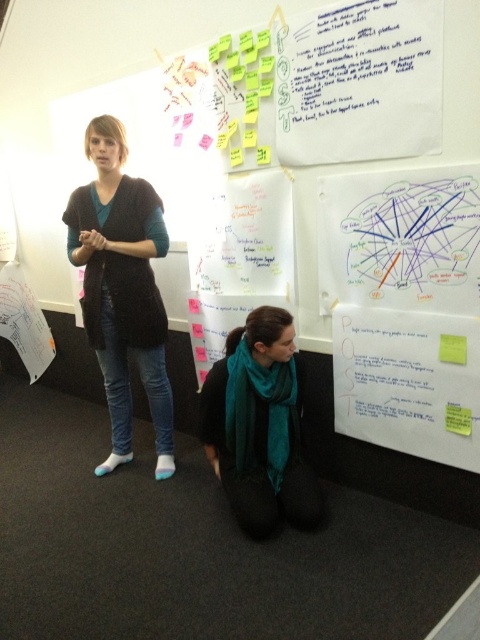
Looking at this image, is white paper at upper center shorter than yellow sticky note at upper right?

No, white paper at upper center is not shorter than yellow sticky note at upper right.

Is point (348, 76) behind point (453, 352)?

Yes, point (348, 76) is behind point (453, 352).

Which is behind, point (338, 84) or point (465, 353)?

Point (338, 84)

In order to click on white paper at upper center in this screenshot , I will do `click(364, 68)`.

Can you confirm if teal scarf at lower center is positioned to the left of yellow paper at lower right?

Yes, teal scarf at lower center is to the left of yellow paper at lower right.

Can you confirm if teal scarf at lower center is taller than yellow paper at lower right?

Indeed, teal scarf at lower center has a greater height compared to yellow paper at lower right.

Which is behind, point (249, 470) or point (470, 410)?

Positioned behind is point (249, 470).

Where is `teal scarf at lower center`? teal scarf at lower center is located at coordinates (260, 426).

Is point (103, 209) closer to camera compared to point (400, 12)?

No, (103, 209) is further to viewer.

Who is more forward, (100,188) or (359,74)?

Point (359,74) is in front.

In order to click on knitted dark gray vest at left in this screenshot , I will do `click(121, 289)`.